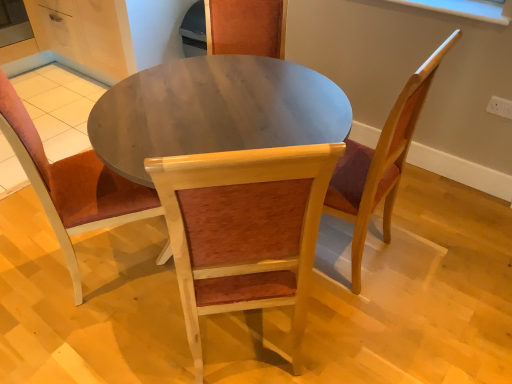
Identify the location of free point to the right of wooden chair with cushion at center, acting as the third chair starting from the left. (426, 257).